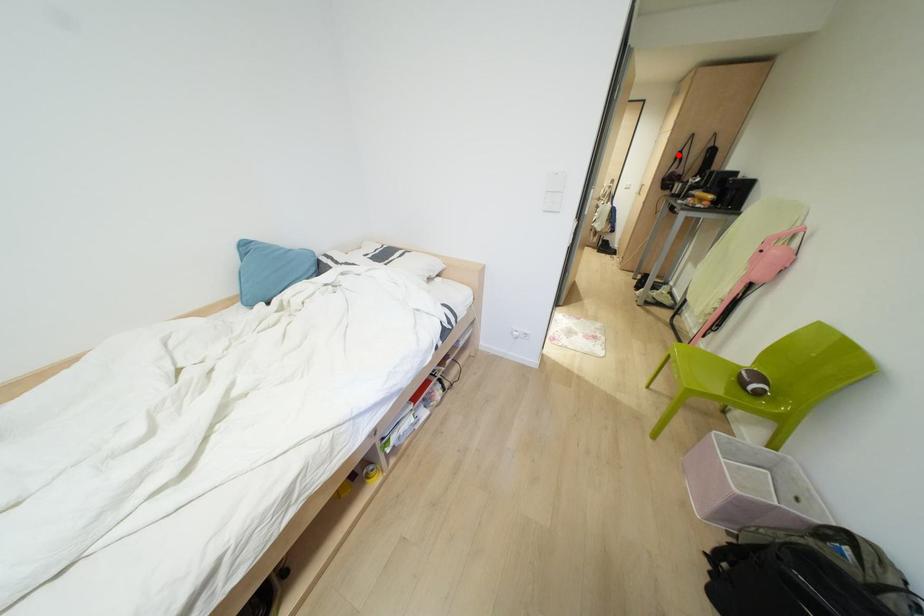
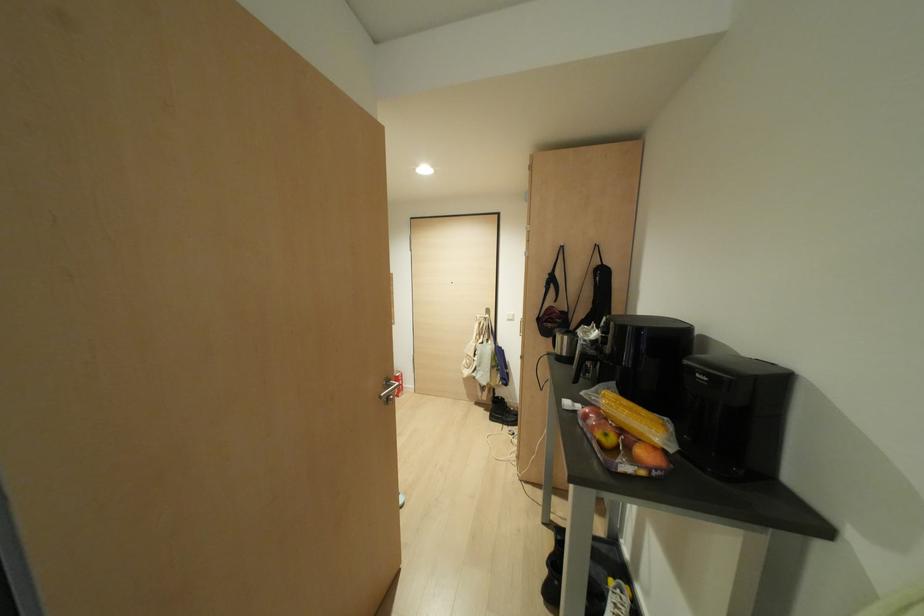
Where in the second image is the point corresponding to the highlighted location from the first image?

(551, 280)